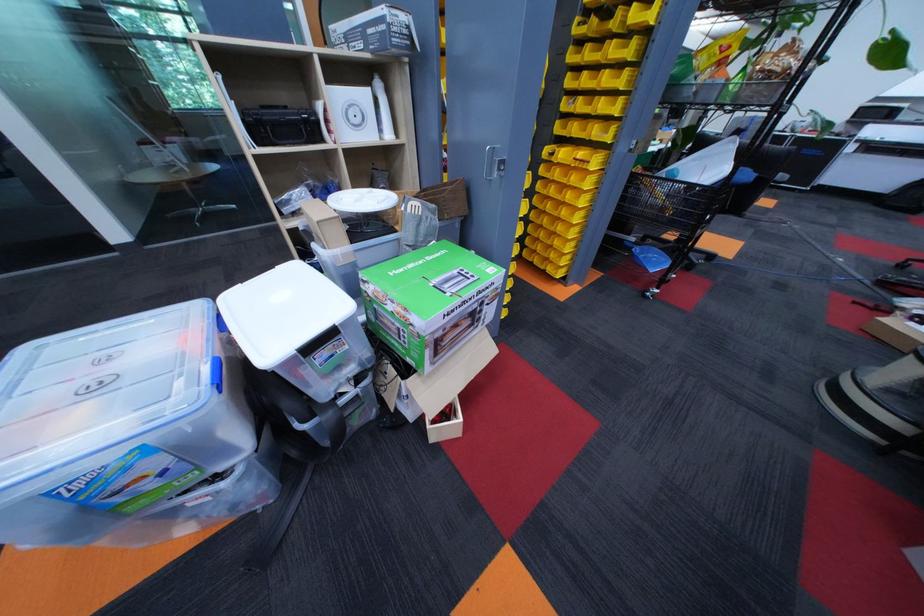
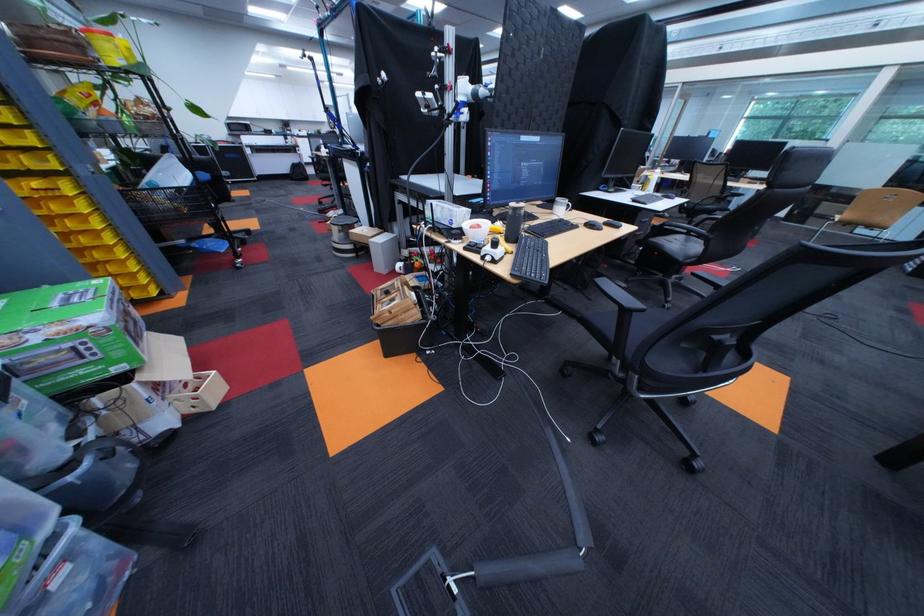
Where in the second image is the point corresponding to pixel 650 251 from the first image?

(209, 246)